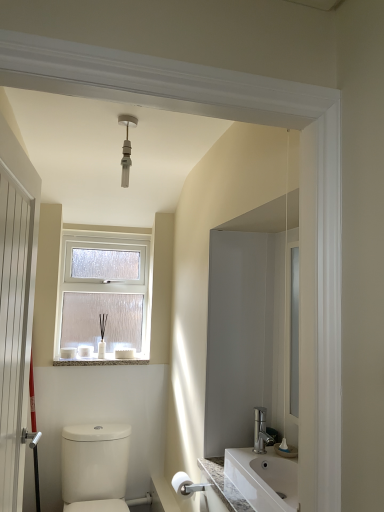
Image resolution: width=384 pixels, height=512 pixels. I want to click on free space above white frosted glass window at upper center (from a real-world perspective), so click(101, 232).